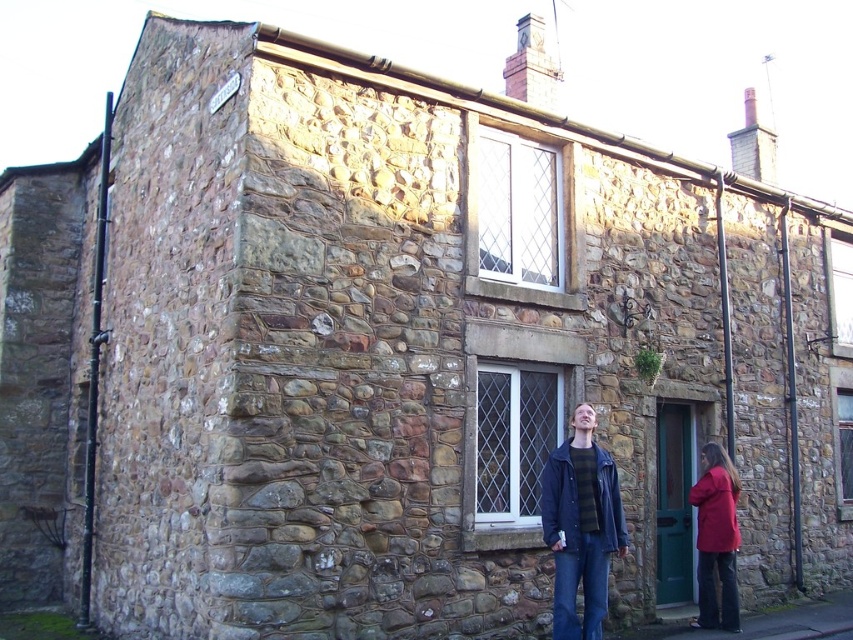
Is dark blue leather jacket at lower center in front of red fabric coat at lower right?

That is True.

Can you confirm if dark blue leather jacket at lower center is positioned to the left of red fabric coat at lower right?

Correct, you'll find dark blue leather jacket at lower center to the left of red fabric coat at lower right.

What are the coordinates of `dark blue leather jacket at lower center` in the screenshot? It's located at (581, 525).